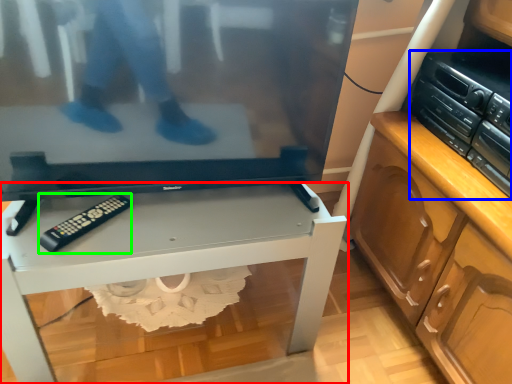
Question: Which is farther away from desk (highlighted by a red box)? stereo (highlighted by a blue box) or control (highlighted by a green box)?

Choices:
 (A) stereo
 (B) control

Answer: (A)